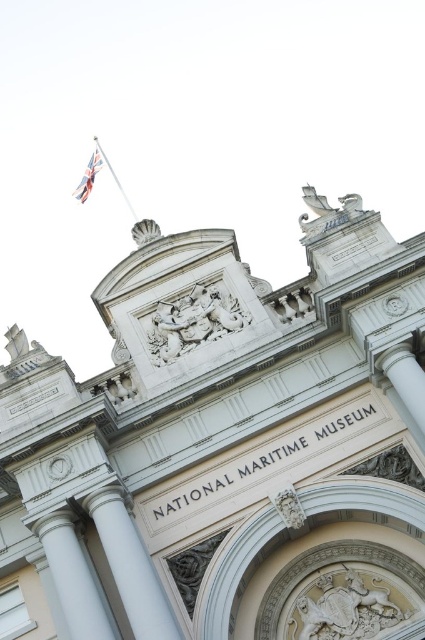
How much distance is there between polished silver flag at upper left and polished silver flag pole at upper left?

They are 3.21 meters apart.

Does polished silver flag at upper left have a larger size compared to polished silver flag pole at upper left?

Incorrect, polished silver flag at upper left is not larger than polished silver flag pole at upper left.

Which is behind, point (95, 164) or point (102, 150)?

Positioned behind is point (102, 150).

Locate an element on the screen. polished silver flag at upper left is located at coordinates (88, 176).